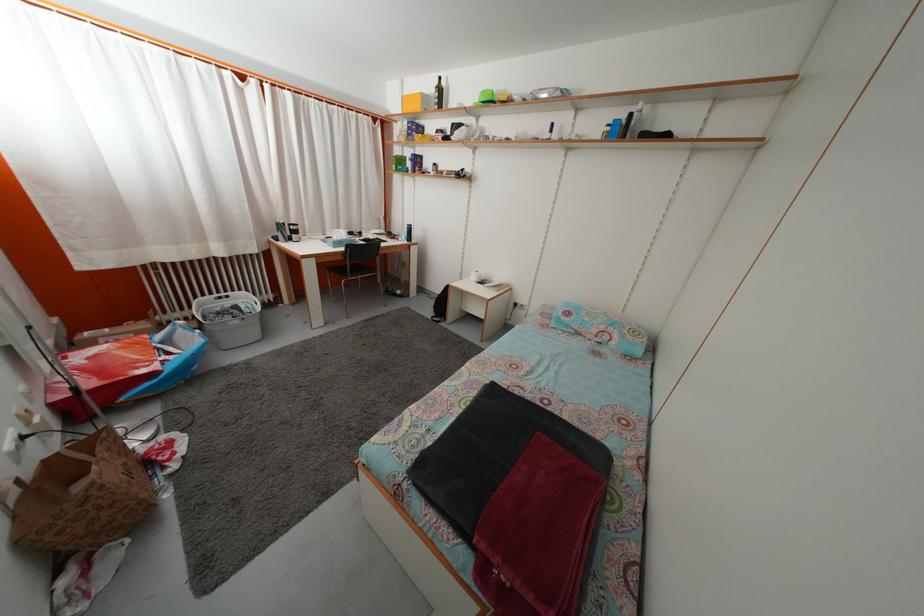
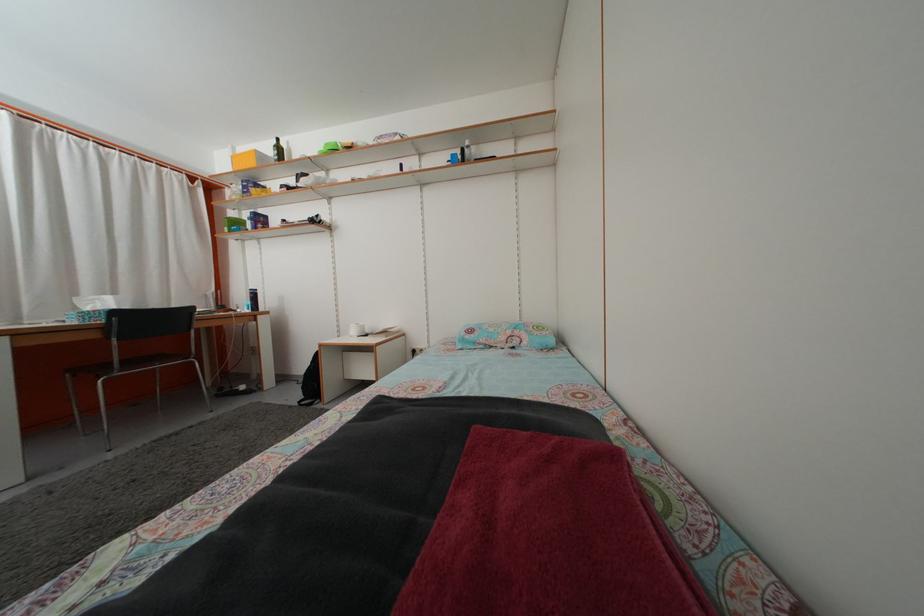
Locate, in the second image, the point that corresponds to [407,89] in the first image.

(239, 156)